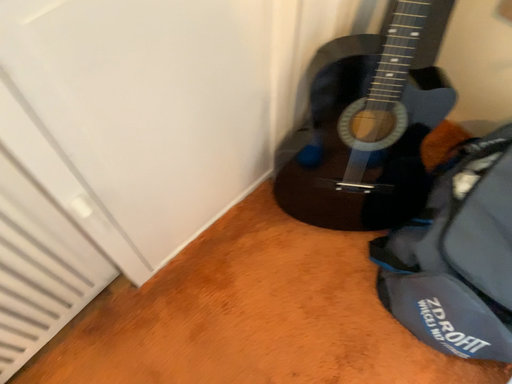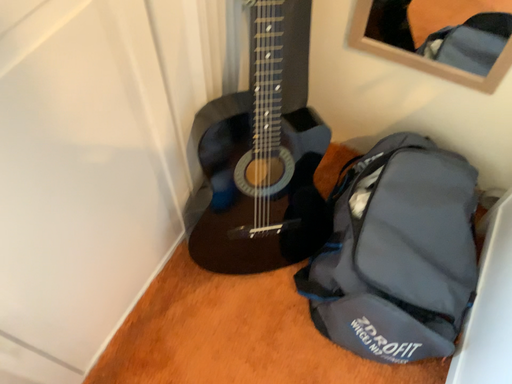
Question: How did the camera likely rotate when shooting the video?

Choices:
 (A) rotated right
 (B) rotated left

Answer: (A)